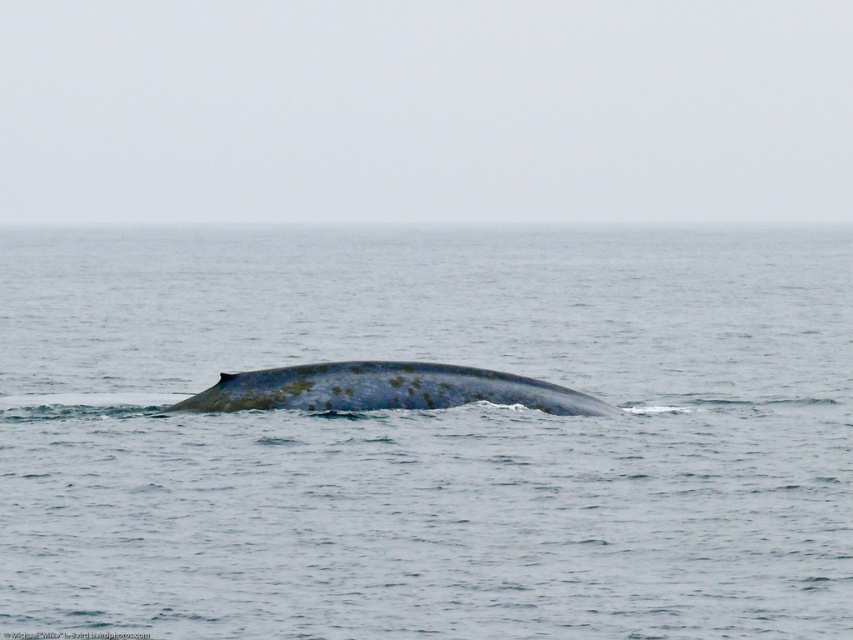
You are a marine biologist studying the ocean surface. You observe the blue matte water at center. Based on its location coordinates, can you determine if it is positioned closer to the top or bottom of the image?

The blue matte water at center is located at point coordinates with a y value of 0.503, which places it closer to the bottom of the image since the y coordinate increases downward in standard image coordinate systems.

You are a marine biologist observing the ocean scene. You notice the blue matte water at center and the blue matte whale at center. Which object is closer to you from your observation point?

The blue matte water at center is closer to you because it is positioned in front of the blue matte whale at center.